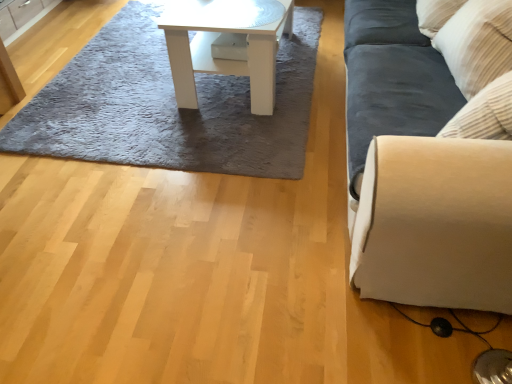
Identify the location of free location to the left of white glossy table at center. This screenshot has width=512, height=384. (112, 74).